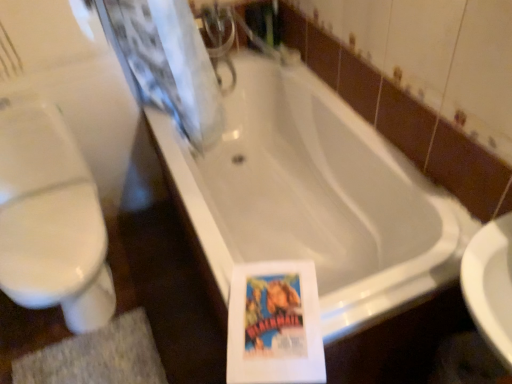
Locate an element on the screen. white glossy toilet at left is located at coordinates (51, 219).

Describe the element at coordinates (97, 357) in the screenshot. I see `gray textured bath mat at lower left` at that location.

Find the location of a particular element. The width and height of the screenshot is (512, 384). gray textured bath mat at lower left is located at coordinates (97, 357).

The height and width of the screenshot is (384, 512). In order to click on white glossy bathtub at center in this screenshot , I will do `click(315, 197)`.

Does white glossy toilet at left have a lesser width compared to white glossy bathtub at center?

Indeed, white glossy toilet at left has a lesser width compared to white glossy bathtub at center.

Between white glossy toilet at left and white glossy bathtub at center, which one appears on the right side from the viewer's perspective?

Positioned to the right is white glossy bathtub at center.

Is white glossy toilet at left oriented towards white glossy bathtub at center?

No, white glossy toilet at left is not turned towards white glossy bathtub at center.

Between white glossy toilet at left and white glossy bathtub at center, which one has larger size?

With larger size is white glossy bathtub at center.

Is white glossy bathtub at center wider than gray textured bath mat at lower left?

Correct, the width of white glossy bathtub at center exceeds that of gray textured bath mat at lower left.

From the picture: Is white glossy bathtub at center in contact with gray textured bath mat at lower left?

white glossy bathtub at center and gray textured bath mat at lower left are not in contact.

Identify the location of bath mat behind the white glossy bathtub at center. (97, 357).

Which of these two, white glossy bathtub at center or gray textured bath mat at lower left, is smaller?

gray textured bath mat at lower left.

Can you confirm if white glossy bathtub at center is bigger than white glossy toilet at left?

Correct, white glossy bathtub at center is larger in size than white glossy toilet at left.

From the image's perspective, between white glossy bathtub at center and white glossy toilet at left, who is located below?

white glossy toilet at left, from the image's perspective.

Is point (437, 271) positioned after point (70, 254)?

No, it is in front of (70, 254).

Is white glossy bathtub at center oriented towards white glossy toilet at left?

Yes.

Is gray textured bath mat at lower left beside white glossy bathtub at center?

No, gray textured bath mat at lower left is not in contact with white glossy bathtub at center.

From the image's perspective, which one is positioned lower, gray textured bath mat at lower left or white glossy bathtub at center?

gray textured bath mat at lower left.

Locate an element on the screen. The width and height of the screenshot is (512, 384). bathtub that is in front of the gray textured bath mat at lower left is located at coordinates (315, 197).

Which object is closer to the camera, gray textured bath mat at lower left or white glossy bathtub at center?

white glossy bathtub at center.

Between gray textured bath mat at lower left and white glossy toilet at left, which one has larger width?

With larger width is white glossy toilet at left.

This screenshot has width=512, height=384. I want to click on bath mat on the right of white glossy toilet at left, so click(x=97, y=357).

Is gray textured bath mat at lower left smaller than white glossy toilet at left?

Indeed, gray textured bath mat at lower left has a smaller size compared to white glossy toilet at left.

Is white glossy toilet at left next to gray textured bath mat at lower left?

No, white glossy toilet at left is not beside gray textured bath mat at lower left.

Between white glossy toilet at left and gray textured bath mat at lower left, which one has less height?

With less height is gray textured bath mat at lower left.

In the scene shown: From the image's perspective, is white glossy toilet at left above or below gray textured bath mat at lower left?

white glossy toilet at left is situated higher than gray textured bath mat at lower left in the image.

Looking at this image, does white glossy toilet at left have a larger size compared to gray textured bath mat at lower left?

Yes.

Find the location of a particular element. The height and width of the screenshot is (384, 512). toilet below the white glossy bathtub at center (from the image's perspective) is located at coordinates (51, 219).

Where is `bathtub in front of the gray textured bath mat at lower left`? This screenshot has width=512, height=384. bathtub in front of the gray textured bath mat at lower left is located at coordinates (315, 197).

Which object lies further to the anchor point gray textured bath mat at lower left, white glossy toilet at left or white glossy bathtub at center?

white glossy bathtub at center.

In the scene shown: From the image, which object appears to be farther from white glossy bathtub at center, white glossy toilet at left or gray textured bath mat at lower left?

gray textured bath mat at lower left is positioned further to the anchor white glossy bathtub at center.

Considering their positions, is gray textured bath mat at lower left positioned closer to white glossy toilet at left than white glossy bathtub at center?

gray textured bath mat at lower left is closer to white glossy toilet at left.

Looking at the image, which one is located further to gray textured bath mat at lower left, white glossy bathtub at center or white glossy toilet at left?

white glossy bathtub at center is further to gray textured bath mat at lower left.

Which object lies nearer to the anchor point white glossy bathtub at center, gray textured bath mat at lower left or white glossy toilet at left?

white glossy toilet at left is closer to white glossy bathtub at center.

Based on their spatial positions, is white glossy bathtub at center or gray textured bath mat at lower left closer to white glossy toilet at left?

gray textured bath mat at lower left is positioned closer to the anchor white glossy toilet at left.

The width and height of the screenshot is (512, 384). In order to click on bath mat located between white glossy toilet at left and white glossy bathtub at center in the left-right direction in this screenshot , I will do `click(97, 357)`.